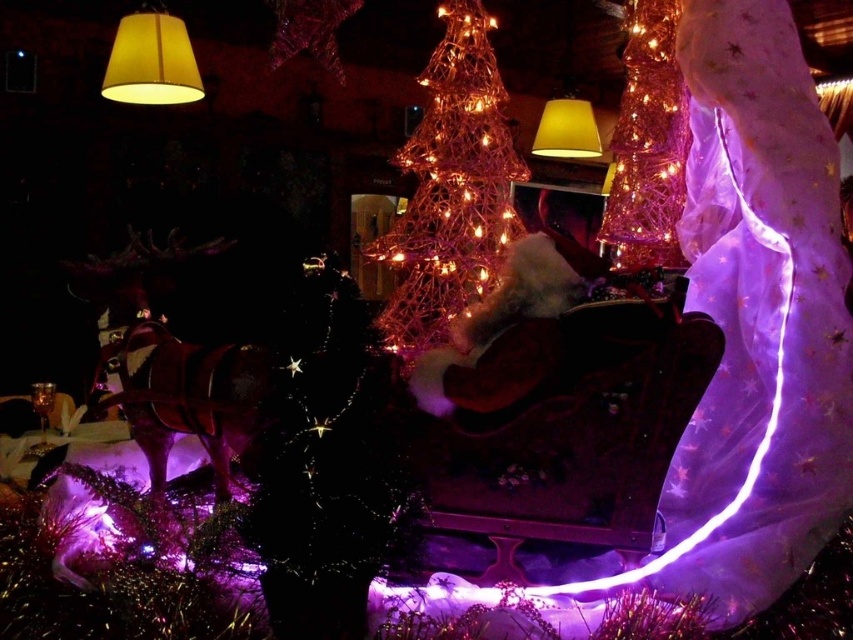
Does iridescent wireframe tree at center appear on the left side of yellow fabric lampshade at upper left?

In fact, iridescent wireframe tree at center is to the right of yellow fabric lampshade at upper left.

Between iridescent wireframe tree at center and yellow fabric lampshade at upper left, which one is positioned lower?

iridescent wireframe tree at center

Is point (445, 163) in front of point (114, 77)?

That is True.

Where is `iridescent wireframe tree at center`? iridescent wireframe tree at center is located at coordinates (451, 188).

Does yellow fabric lampshade at upper left lie behind yellow fabric lampshade at upper center?

A: No, it is in front of yellow fabric lampshade at upper center.

Does yellow fabric lampshade at upper left have a lesser height compared to yellow fabric lampshade at upper center?

No.

Where is `yellow fabric lampshade at upper left`? Image resolution: width=853 pixels, height=640 pixels. yellow fabric lampshade at upper left is located at coordinates (151, 61).

Is iridescent wireframe cone at upper right shorter than yellow fabric lampshade at upper left?

No.

Can you confirm if iridescent wireframe cone at upper right is bigger than yellow fabric lampshade at upper left?

Yes, iridescent wireframe cone at upper right is bigger than yellow fabric lampshade at upper left.

Who is more forward, (639, 224) or (122, 77)?

Point (639, 224) is in front.

Where is `iridescent wireframe cone at upper right`? iridescent wireframe cone at upper right is located at coordinates (647, 141).